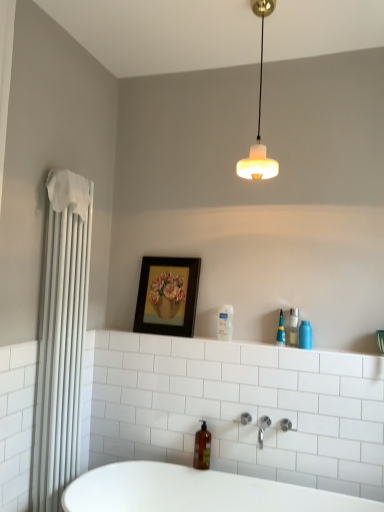
Question: Is wooden framed painting at center to the left of clear glass bottle at upper right, which is the third toiletry from left to right, from the viewer's perspective?

Choices:
 (A) no
 (B) yes

Answer: (B)

Question: Does wooden framed painting at center have a lesser height compared to clear glass bottle at upper right, marked as the second toiletry in a right-to-left arrangement?

Choices:
 (A) yes
 (B) no

Answer: (B)

Question: Is wooden framed painting at center facing towards clear glass bottle at upper right, which is the third toiletry from left to right?

Choices:
 (A) yes
 (B) no

Answer: (B)

Question: From a real-world perspective, is wooden framed painting at center positioned under clear glass bottle at upper right, which is the third toiletry from left to right, based on gravity?

Choices:
 (A) no
 (B) yes

Answer: (A)

Question: Is wooden framed painting at center smaller than clear glass bottle at upper right, which is the third toiletry from left to right?

Choices:
 (A) no
 (B) yes

Answer: (A)

Question: Looking at their shapes, would you say blue glossy bottle at upper right, placed as the fourth toiletry when sorted from left to right, is wider or thinner than clear plastic bottle at center, the first toiletry when ordered from left to right?

Choices:
 (A) wide
 (B) thin

Answer: (A)

Question: Considering their positions, is blue glossy bottle at upper right, placed as the fourth toiletry when sorted from left to right, located in front of or behind clear plastic bottle at center, the first toiletry when ordered from left to right?

Choices:
 (A) behind
 (B) front

Answer: (B)

Question: Choose the correct answer: Is blue glossy bottle at upper right, acting as the first toiletry starting from the right, inside clear plastic bottle at center, the 4th toiletry in the right-to-left sequence, or outside it?

Choices:
 (A) inside
 (B) outside

Answer: (B)

Question: Is blue glossy bottle at upper right, acting as the first toiletry starting from the right, to the left or to the right of clear plastic bottle at center, the first toiletry when ordered from left to right, in the image?

Choices:
 (A) right
 (B) left

Answer: (A)

Question: Visually, is white frosted glass lampshade at upper center positioned to the left or to the right of wooden framed painting at center?

Choices:
 (A) left
 (B) right

Answer: (B)

Question: In terms of width, does white frosted glass lampshade at upper center look wider or thinner when compared to wooden framed painting at center?

Choices:
 (A) thin
 (B) wide

Answer: (B)

Question: From the image's perspective, is white frosted glass lampshade at upper center above or below wooden framed painting at center?

Choices:
 (A) below
 (B) above

Answer: (B)

Question: Relative to wooden framed painting at center, is white frosted glass lampshade at upper center in front or behind?

Choices:
 (A) front
 (B) behind

Answer: (A)

Question: Is white frosted glass lampshade at upper center bigger or smaller than clear plastic bottle at center, the first toiletry when ordered from left to right?

Choices:
 (A) small
 (B) big

Answer: (B)

Question: Do you think white frosted glass lampshade at upper center is within clear plastic bottle at center, the 4th toiletry in the right-to-left sequence, or outside of it?

Choices:
 (A) inside
 (B) outside

Answer: (B)